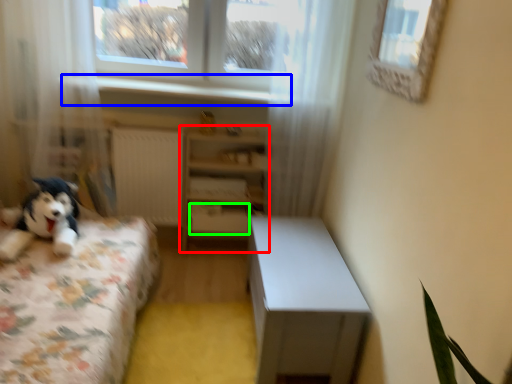
Question: Which object is the farthest from shelf (highlighted by a red box)? Choose among these: window sill (highlighted by a blue box) or drawer (highlighted by a green box).

Choices:
 (A) window sill
 (B) drawer

Answer: (A)